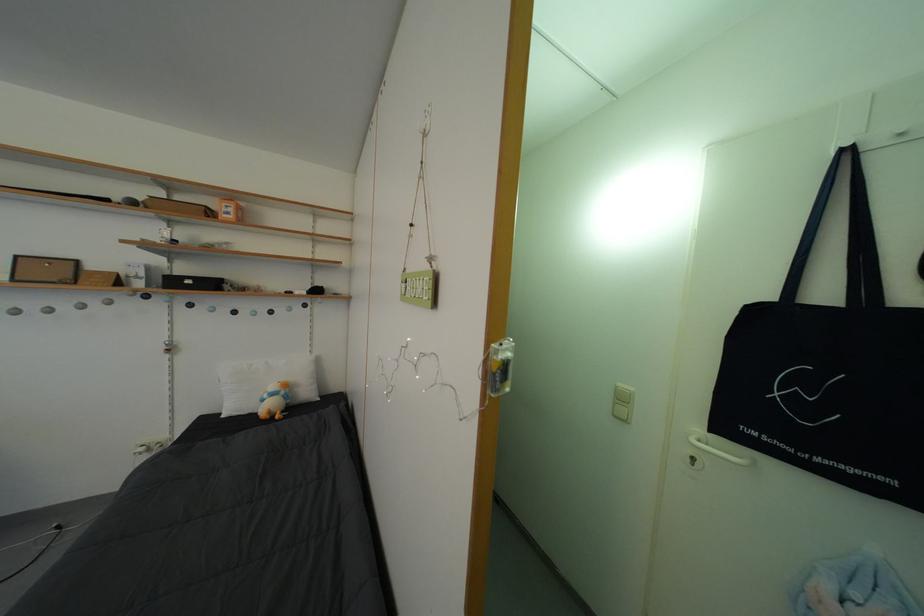
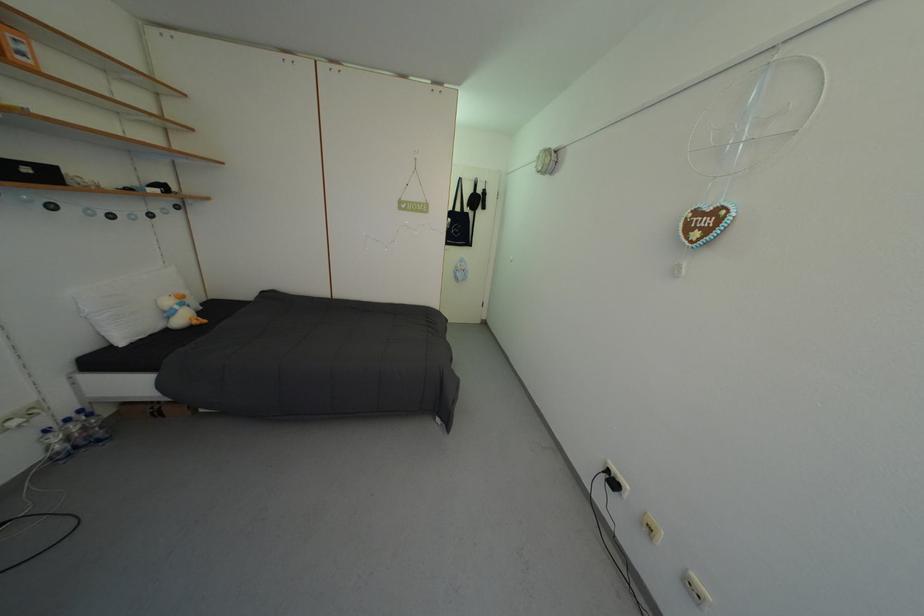
The point at (x=237, y=220) is marked in the first image. Where is the corresponding point in the second image?

(30, 60)